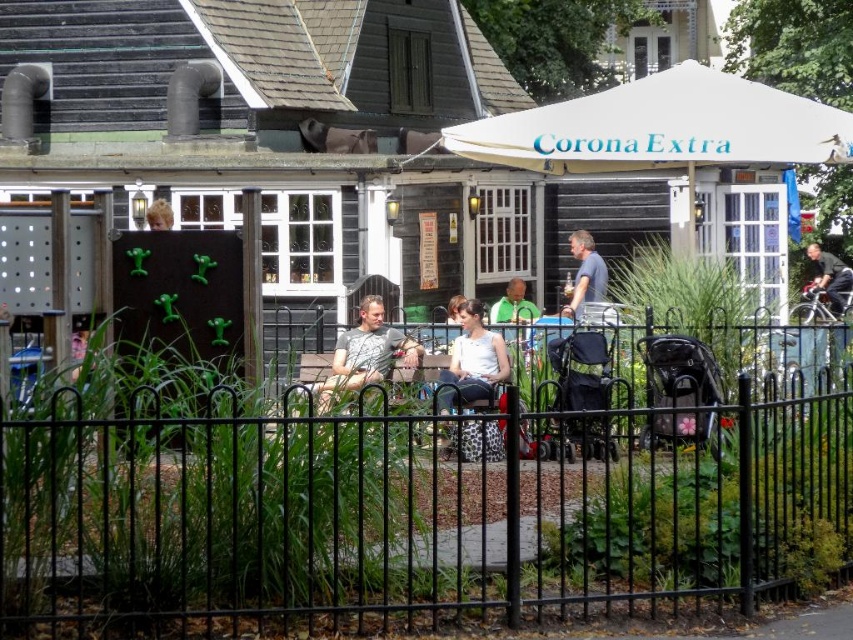
Does white matte tank top at center have a greater height compared to blonde hair at center?

Yes, white matte tank top at center is taller than blonde hair at center.

Between point (454, 360) and point (160, 227), which one is positioned in front?

Positioned in front is point (454, 360).

What are the coordinates of `white matte tank top at center` in the screenshot? It's located at (473, 362).

Which is more to the left, light gray fabric shirt at center or gray fabric shirt at center?

light gray fabric shirt at center is more to the left.

Is light gray fabric shirt at center shorter than gray fabric shirt at center?

Yes, light gray fabric shirt at center is shorter than gray fabric shirt at center.

The height and width of the screenshot is (640, 853). Describe the element at coordinates (364, 353) in the screenshot. I see `light gray fabric shirt at center` at that location.

Identify the location of light gray fabric shirt at center. Image resolution: width=853 pixels, height=640 pixels. (364, 353).

Which is above, black metal fence at center or dark blue shirt at upper right?

Positioned higher is dark blue shirt at upper right.

Is black metal fence at center positioned behind dark blue shirt at upper right?

No, black metal fence at center is closer to the viewer.

What do you see at coordinates (416, 506) in the screenshot? Image resolution: width=853 pixels, height=640 pixels. I see `black metal fence at center` at bounding box center [416, 506].

I want to click on black metal fence at center, so click(416, 506).